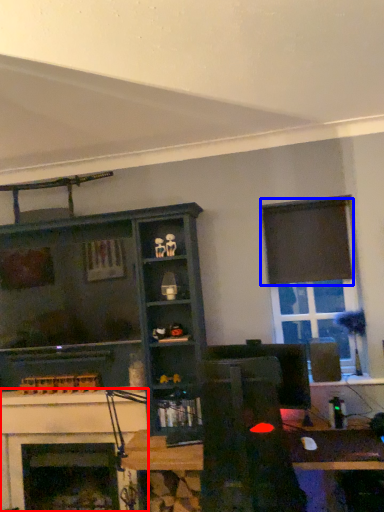
Question: Among these objects, which one is nearest to the camera, fireplace (highlighted by a red box) or curtain (highlighted by a blue box)?

Choices:
 (A) fireplace
 (B) curtain

Answer: (A)